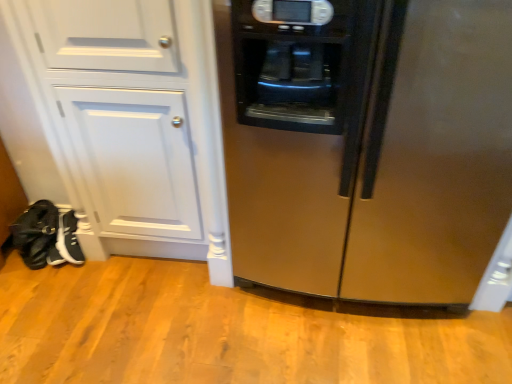
What are the coordinates of `stainless steel refrigerator at right` in the screenshot? It's located at (369, 147).

The image size is (512, 384). What do you see at coordinates (369, 147) in the screenshot? I see `stainless steel refrigerator at right` at bounding box center [369, 147].

Locate an element on the screen. Image resolution: width=512 pixels, height=384 pixels. stainless steel refrigerator at right is located at coordinates pos(369,147).